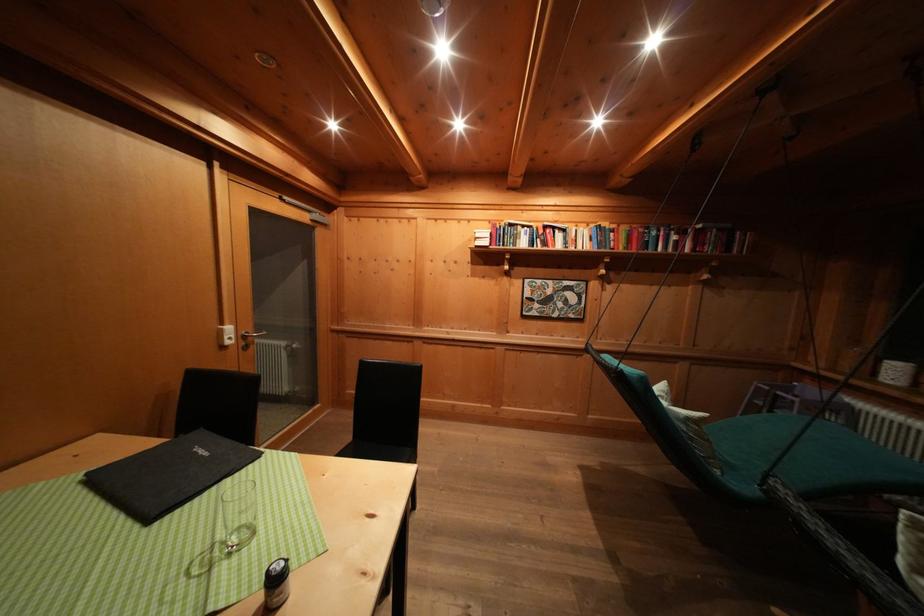
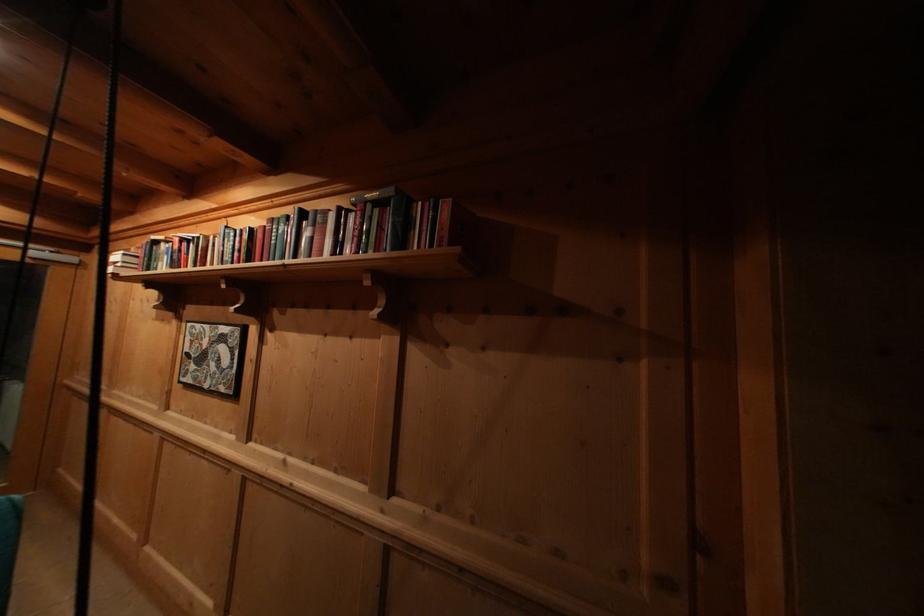
Locate, in the second image, the point that corresponds to point 545,286 in the first image.

(204, 331)